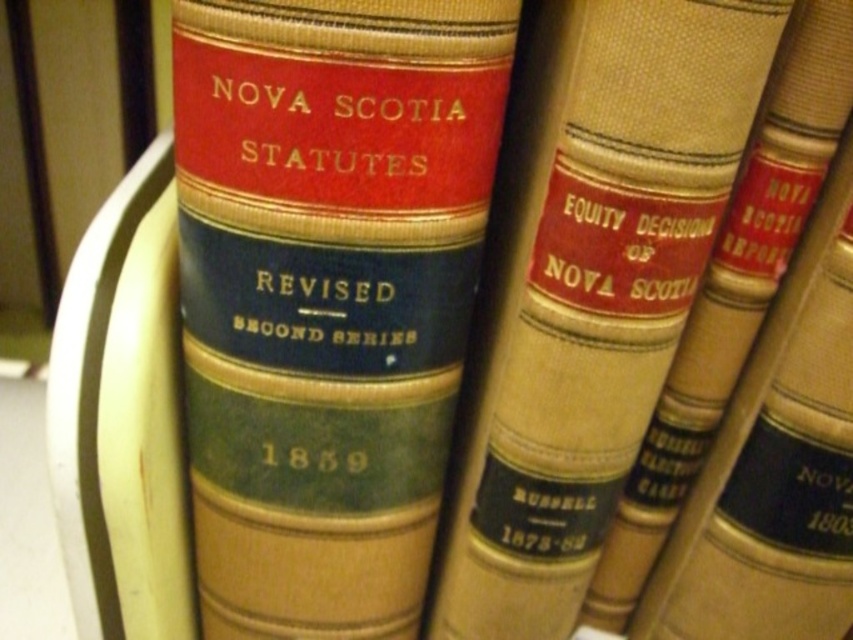
Question: Where is matte leather book at center located in relation to beige leather book at center in the image?

Choices:
 (A) left
 (B) right

Answer: (A)

Question: Which point appears farthest from the camera in this image?

Choices:
 (A) (585, 241)
 (B) (405, 29)

Answer: (A)

Question: Does matte leather book at center have a greater width compared to beige leather book at center?

Choices:
 (A) yes
 (B) no

Answer: (A)

Question: Which point appears farthest from the camera in this image?

Choices:
 (A) (439, 177)
 (B) (666, 100)

Answer: (A)

Question: Which object is farther from the camera taking this photo?

Choices:
 (A) beige leather book at center
 (B) matte leather book at center

Answer: (B)

Question: Is matte leather book at center closer to the viewer compared to beige leather book at center?

Choices:
 (A) no
 (B) yes

Answer: (A)